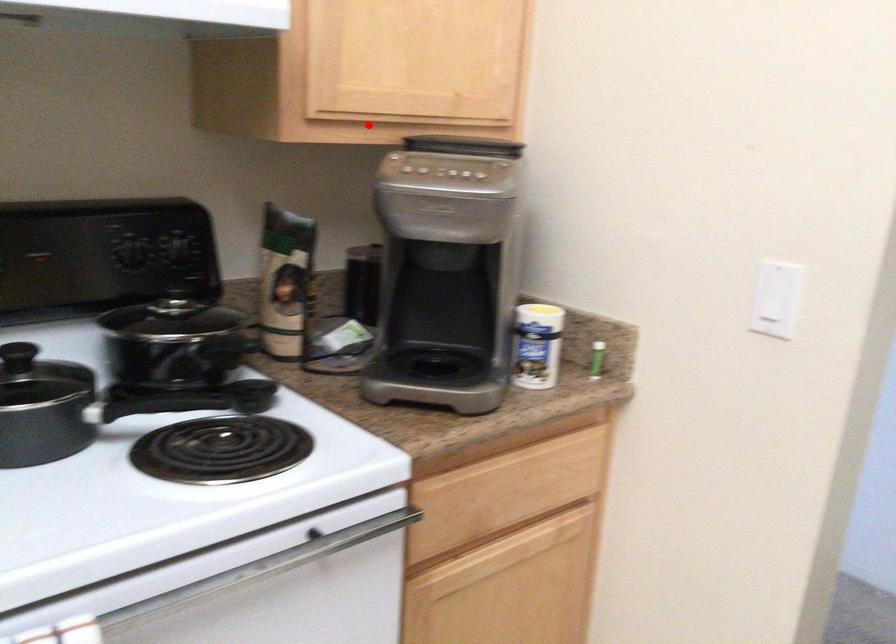
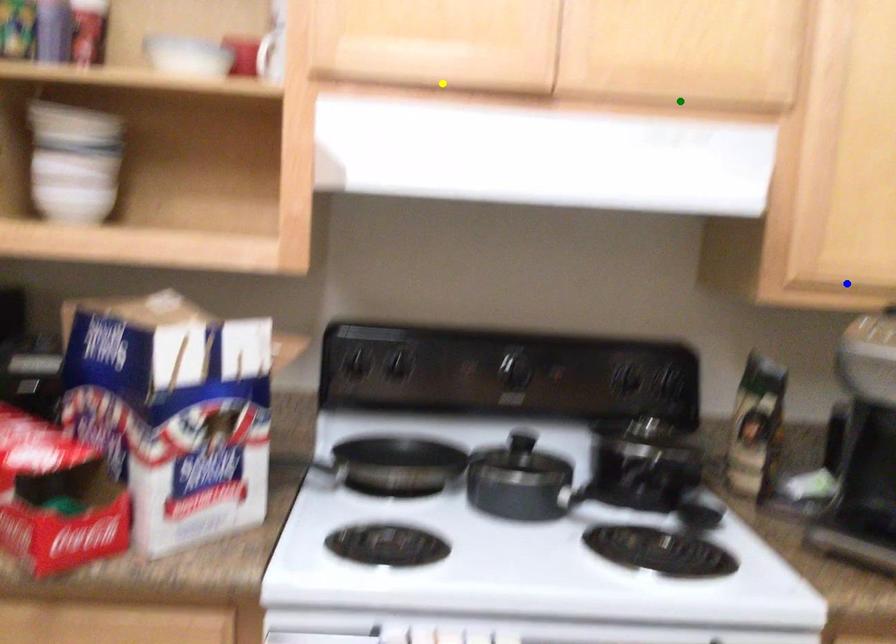
Question: I am providing you with two images of the same scene from different viewpoints. A red point is marked on the first image. You are given multiple points on the second image. Which point in image 2 represents the same 3d spot as the red point in image 1?

Choices:
 (A) green point
 (B) yellow point
 (C) blue point

Answer: (C)